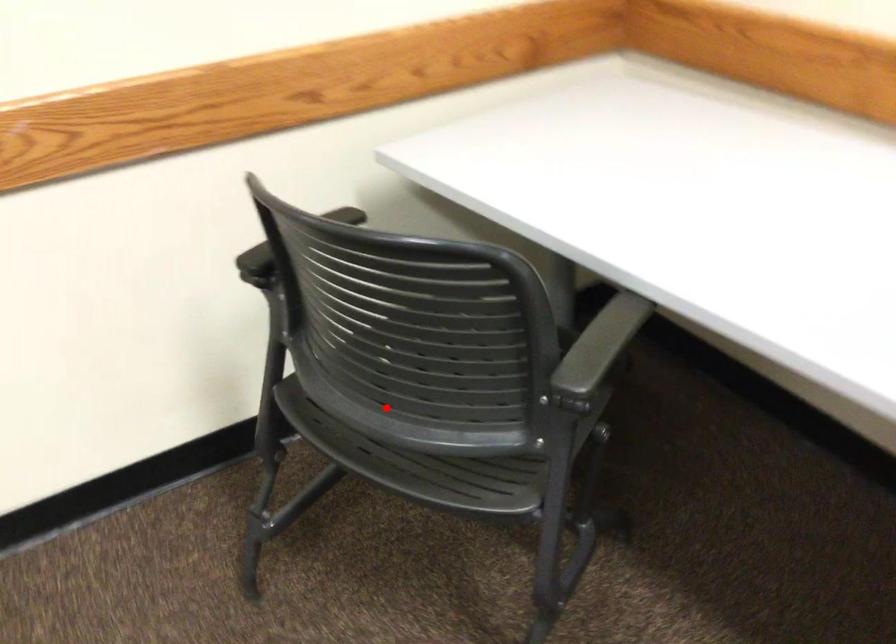
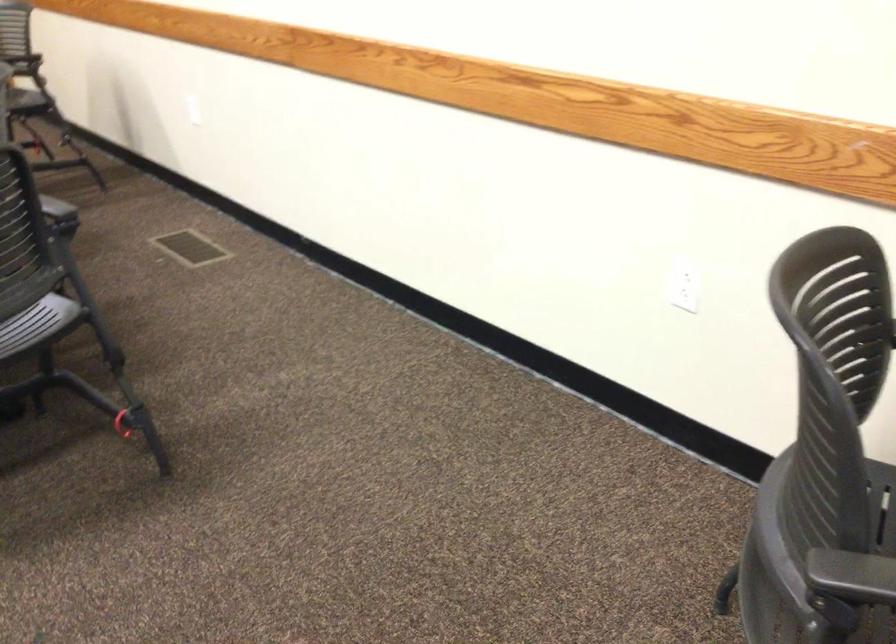
Where in the second image is the point corresponding to the highlighted location from the first image?

(881, 547)